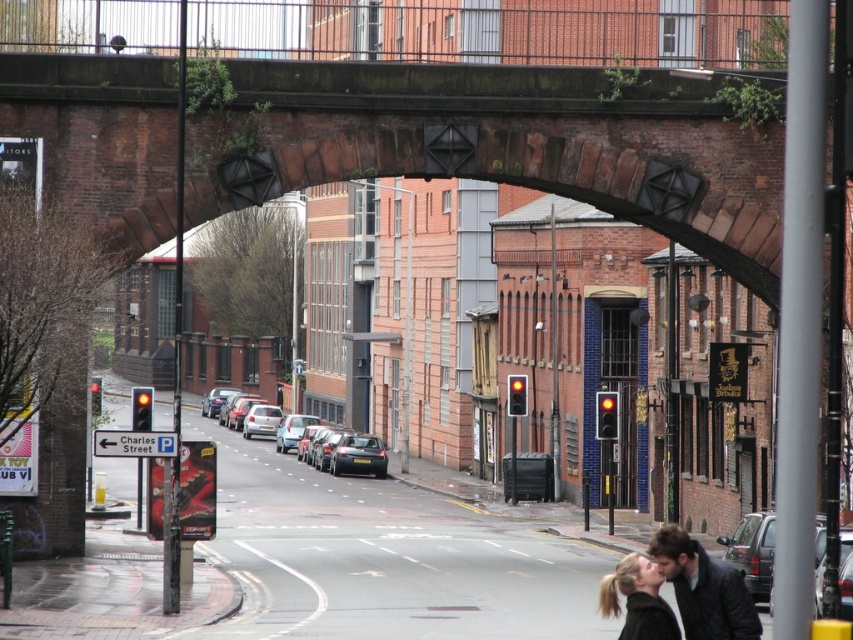
You are standing at the point marked by coordinates point (517, 144) in the image. What object are you directly under?

You are directly under the brick archway at center.